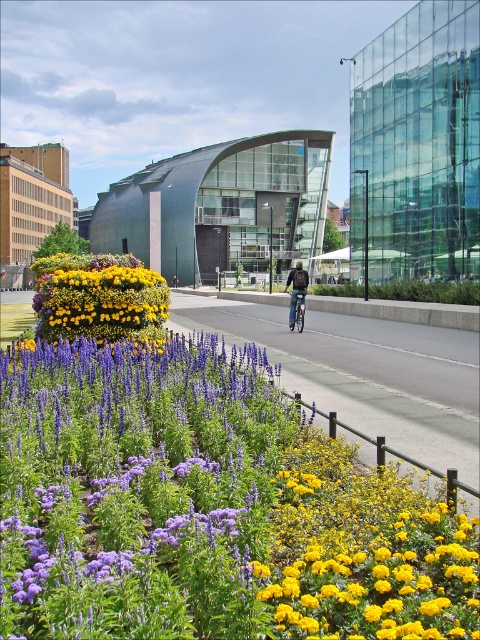
Based on the photo, does purple soft-textured flowers at center-left have a smaller size compared to dark blue jeans at center?

Correct, purple soft-textured flowers at center-left occupies less space than dark blue jeans at center.

Consider the image. Between purple soft-textured flowers at center-left and dark blue jeans at center, which one appears on the left side from the viewer's perspective?

purple soft-textured flowers at center-left is more to the left.

The height and width of the screenshot is (640, 480). Describe the element at coordinates (206, 508) in the screenshot. I see `purple soft-textured flowers at center-left` at that location.

Image resolution: width=480 pixels, height=640 pixels. I want to click on purple soft-textured flowers at center-left, so pyautogui.click(x=206, y=508).

Is point (264, 412) positioned after point (296, 301)?

That is False.

In the scene shown: Is purple soft-textured flowers at center-left wider than metallic silver bicycle at center?

Correct, the width of purple soft-textured flowers at center-left exceeds that of metallic silver bicycle at center.

Between point (26, 410) and point (299, 307), which one is positioned in front?

Positioned in front is point (26, 410).

The height and width of the screenshot is (640, 480). Identify the location of purple soft-textured flowers at center-left. (206, 508).

Can you confirm if purple soft-textured flowers at center-left is smaller than matte yellow flowers at center?

Correct, purple soft-textured flowers at center-left occupies less space than matte yellow flowers at center.

Can you confirm if purple soft-textured flowers at center-left is taller than matte yellow flowers at center?

Incorrect, purple soft-textured flowers at center-left's height is not larger of matte yellow flowers at center's.

Does point (223, 368) lie in front of point (44, 268)?

Yes, it is.

The image size is (480, 640). Find the location of `purple soft-textured flowers at center-left`. purple soft-textured flowers at center-left is located at coordinates (206, 508).